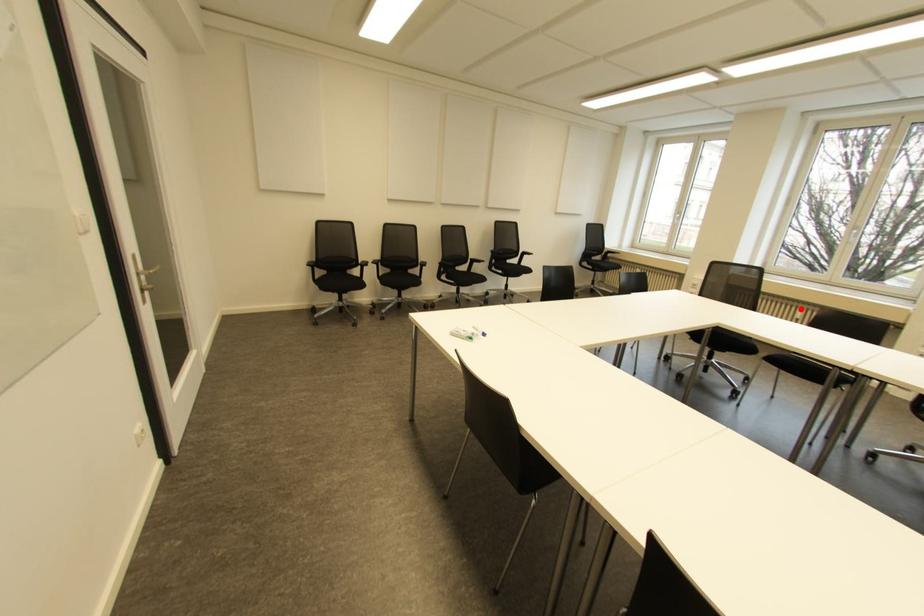
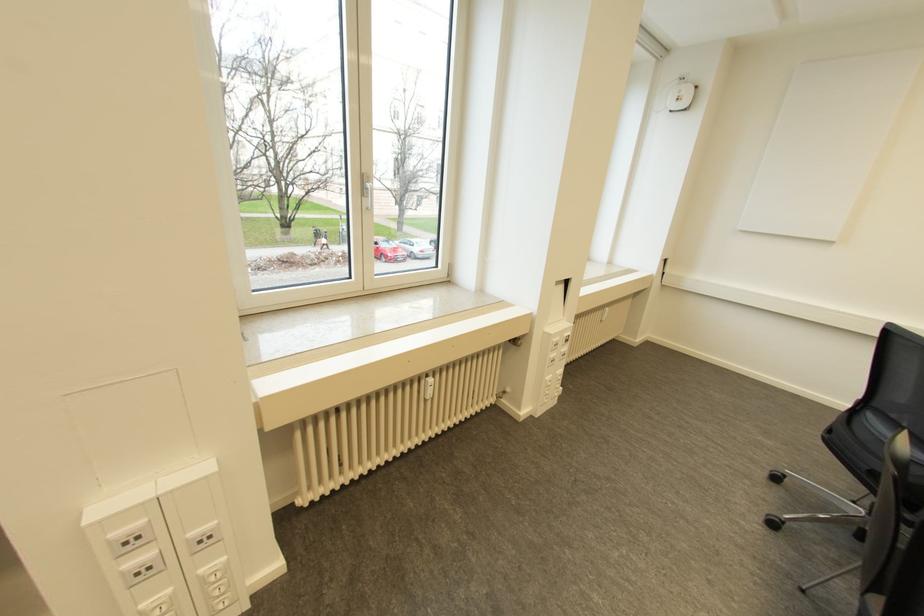
In the second image, find the point that corresponds to the highlighted location in the first image.

(430, 379)